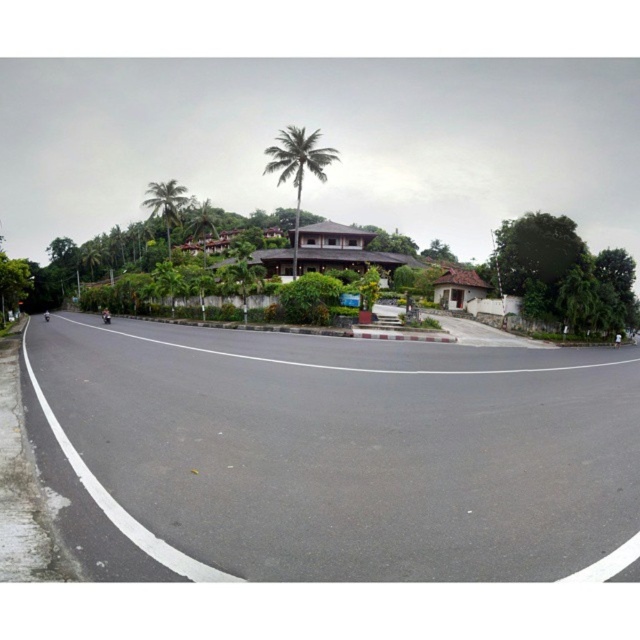
Question: Can you confirm if black asphalt road at lower left is smaller than green leafy palm tree at center?

Choices:
 (A) no
 (B) yes

Answer: (B)

Question: Is black asphalt road at lower left positioned before green leafy palm tree at center?

Choices:
 (A) yes
 (B) no

Answer: (A)

Question: Estimate the real-world distances between objects in this image. Which object is farther from the black asphalt road at lower left?

Choices:
 (A) green leafy palm tree at center
 (B) green leafy palm tree at upper center

Answer: (B)

Question: Does black asphalt road at lower left appear under green leafy palm tree at center?

Choices:
 (A) yes
 (B) no

Answer: (A)

Question: Which point appears closest to the camera in this image?

Choices:
 (A) (172, 220)
 (B) (131, 333)

Answer: (B)

Question: Estimate the real-world distances between objects in this image. Which object is closer to the black asphalt road at lower left?

Choices:
 (A) green leafy palm tree at upper center
 (B) green leafy palm tree at center

Answer: (B)